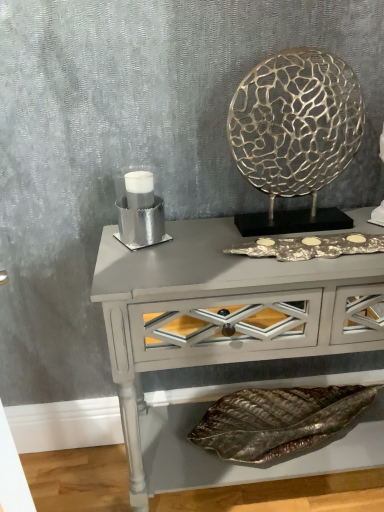
Question: Is metallic leaf at lower center taller than silver metallic candle holder at left?

Choices:
 (A) yes
 (B) no

Answer: (B)

Question: Is silver metallic candle holder at left surrounded by metallic leaf at lower center?

Choices:
 (A) yes
 (B) no

Answer: (B)

Question: Are metallic leaf at lower center and silver metallic candle holder at left far apart?

Choices:
 (A) no
 (B) yes

Answer: (A)

Question: Is metallic leaf at lower center wider than silver metallic candle holder at left?

Choices:
 (A) no
 (B) yes

Answer: (B)

Question: Is metallic leaf at lower center in contact with silver metallic candle holder at left?

Choices:
 (A) yes
 (B) no

Answer: (B)

Question: Looking at their shapes, would you say gold textured metal at upper right is wider or thinner than silver metallic candle holder at left?

Choices:
 (A) thin
 (B) wide

Answer: (A)

Question: From the image's perspective, is gold textured metal at upper right above or below silver metallic candle holder at left?

Choices:
 (A) below
 (B) above

Answer: (B)

Question: Looking at the image, does gold textured metal at upper right seem bigger or smaller compared to silver metallic candle holder at left?

Choices:
 (A) small
 (B) big

Answer: (B)

Question: Is gold textured metal at upper right spatially inside silver metallic candle holder at left, or outside of it?

Choices:
 (A) inside
 (B) outside

Answer: (B)

Question: Is matte gray console table at center taller or shorter than silver metallic candle holder at left?

Choices:
 (A) short
 (B) tall

Answer: (B)

Question: Is point (311, 346) closer or farther from the camera than point (127, 169)?

Choices:
 (A) closer
 (B) farther

Answer: (A)

Question: Is matte gray console table at center bigger or smaller than silver metallic candle holder at left?

Choices:
 (A) small
 (B) big

Answer: (B)

Question: In the image, is matte gray console table at center positioned in front of or behind silver metallic candle holder at left?

Choices:
 (A) front
 (B) behind

Answer: (A)

Question: Looking at the image, does silver metallic candle holder at left seem bigger or smaller compared to metallic leaf at lower center?

Choices:
 (A) small
 (B) big

Answer: (A)

Question: Considering the positions of point click(160, 230) and point click(336, 409), is point click(160, 230) closer or farther from the camera than point click(336, 409)?

Choices:
 (A) closer
 (B) farther

Answer: (A)